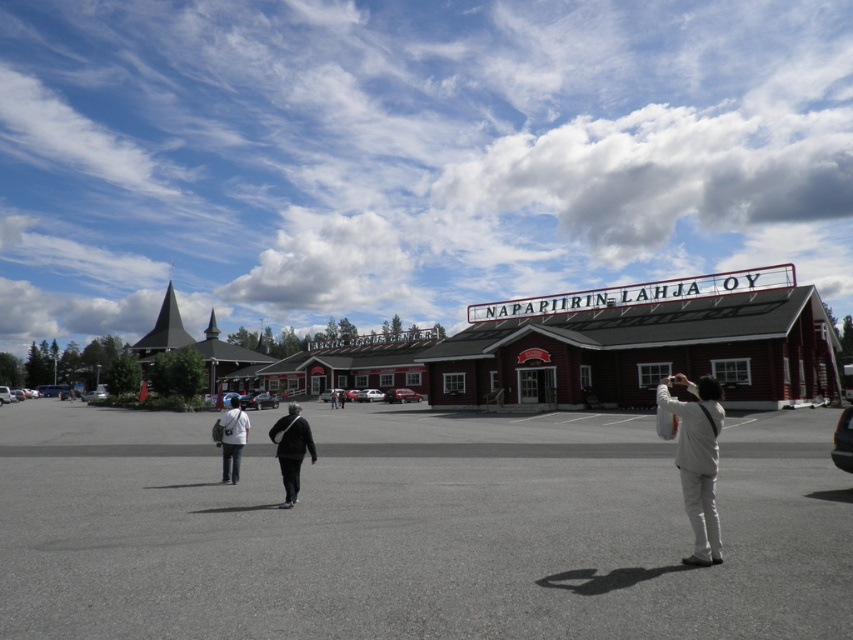
Question: Is white fabric camera at center positioned in front of dark gray fabric couple at center?

Choices:
 (A) no
 (B) yes

Answer: (B)

Question: Which of the following is the farthest from the observer?

Choices:
 (A) (303, 420)
 (B) (294, 406)
 (C) (709, 384)

Answer: (B)

Question: Which point is closer to the camera taking this photo?

Choices:
 (A) (224, 440)
 (B) (224, 428)

Answer: (B)

Question: Is white fabric camera at center wider than dark gray fabric couple at center?

Choices:
 (A) yes
 (B) no

Answer: (B)

Question: From the image, what is the correct spatial relationship of dark gray suit at center in relation to light beige fabric bag at center?

Choices:
 (A) above
 (B) below

Answer: (B)

Question: Among these objects, which one is nearest to the camera?

Choices:
 (A) dark gray fabric couple at center
 (B) dark gray suit at center
 (C) white fabric camera at center
 (D) gray asphalt parking lot at center

Answer: (D)